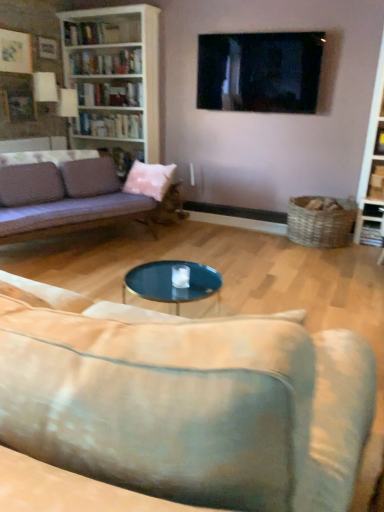
Question: From a real-world perspective, is hardcover books at upper left, the first book from the bottom, positioned above or below velvet purple couch at left, the first studio couch viewed from the back?

Choices:
 (A) above
 (B) below

Answer: (A)

Question: From the image's perspective, is hardcover books at upper left, the second book from the top, located above or below velvet purple couch at left, the second studio couch positioned from the front?

Choices:
 (A) below
 (B) above

Answer: (B)

Question: Which object is the farthest from the velvet beige couch at lower center, acting as the 2th studio couch starting from the back?

Choices:
 (A) white glossy bookshelf at upper left
 (B) white glossy bookshelf at upper left, the 2th book positioned from the bottom
 (C) pink fabric pillow at center
 (D) hardcover books at upper left, the second book from the top
 (E) black glossy tv at upper center

Answer: (A)

Question: Considering the real-world distances, which object is closest to the pink fabric pillow at center?

Choices:
 (A) velvet beige couch at lower center, the 1th studio couch viewed from the front
 (B) white glossy bookshelf at upper left
 (C) white wood bookcase at upper left
 (D) white glossy bookshelf at upper left, which is the first book in top-to-bottom order
 (E) velvet purple couch at left, the second studio couch positioned from the front

Answer: (E)